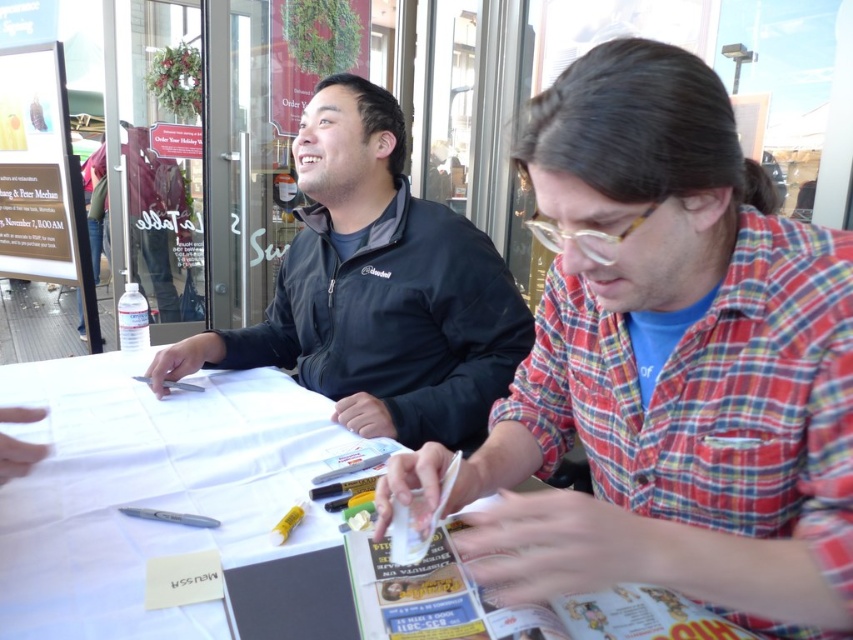
Question: Is black softshell jacket at upper center positioned behind matte white sign at upper left?

Choices:
 (A) yes
 (B) no

Answer: (B)

Question: Among these objects, which one is nearest to the camera?

Choices:
 (A) plaid shirt at center
 (B) matte white sign at upper left

Answer: (A)

Question: Estimate the real-world distances between objects in this image. Which object is closer to the black softshell jacket at upper center?

Choices:
 (A) plaid shirt at center
 (B) matte white sign at upper left

Answer: (A)

Question: Which of the following is the closest to the observer?

Choices:
 (A) black softshell jacket at upper center
 (B) matte white sign at upper left
 (C) plaid shirt at center

Answer: (C)

Question: Can you confirm if black softshell jacket at upper center is smaller than matte white sign at upper left?

Choices:
 (A) yes
 (B) no

Answer: (B)

Question: In this image, where is plaid shirt at center located relative to matte white sign at upper left?

Choices:
 (A) left
 (B) right

Answer: (B)